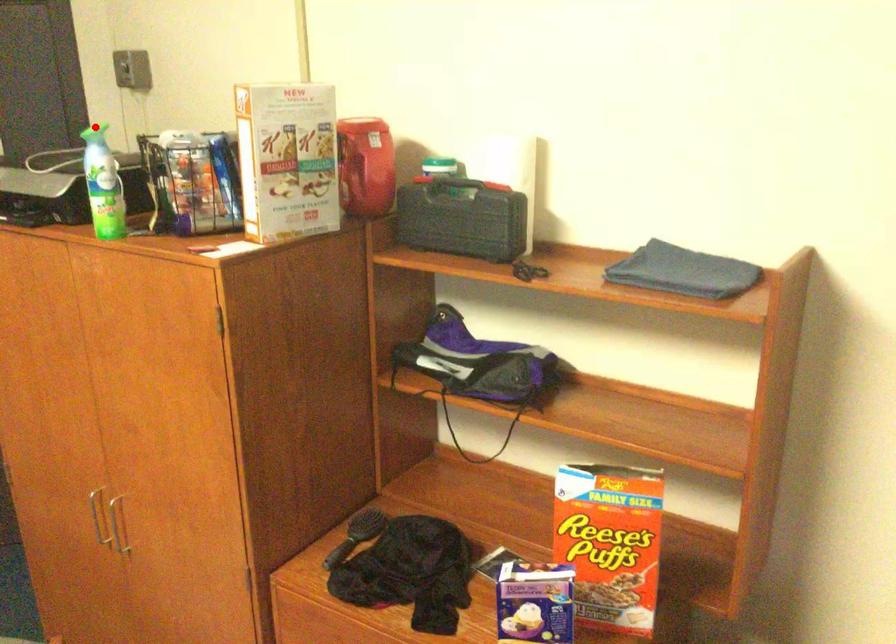
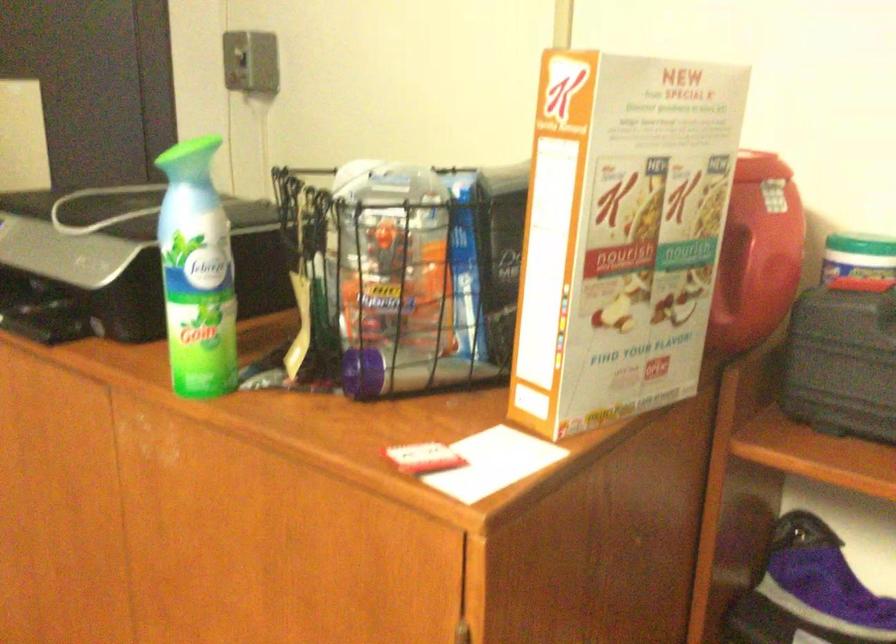
Question: I am providing you with two images of the same scene from different viewpoints. In image1, a red point is highlighted. Considering the same 3D point in image2, which of the following is correct?

Choices:
 (A) It is closer
 (B) It is farther

Answer: (A)